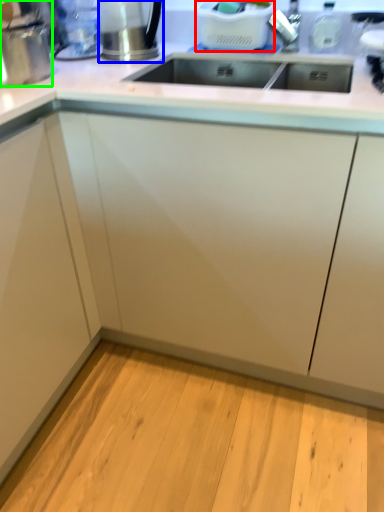
Question: Based on their relative distances, which object is nearer to appliance (highlighted by a red box)? Choose from appliance (highlighted by a blue box) and appliance (highlighted by a green box).

Choices:
 (A) appliance
 (B) appliance

Answer: (A)